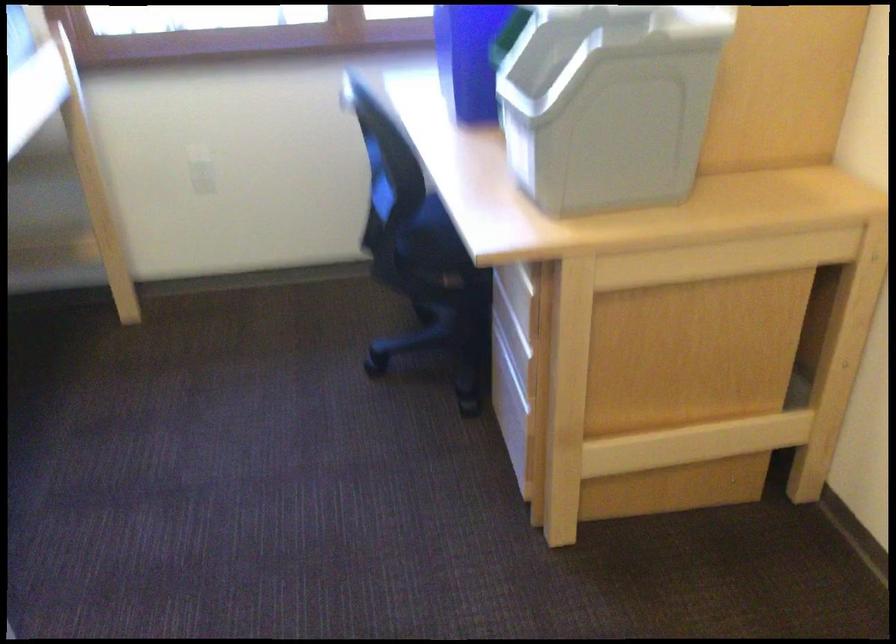
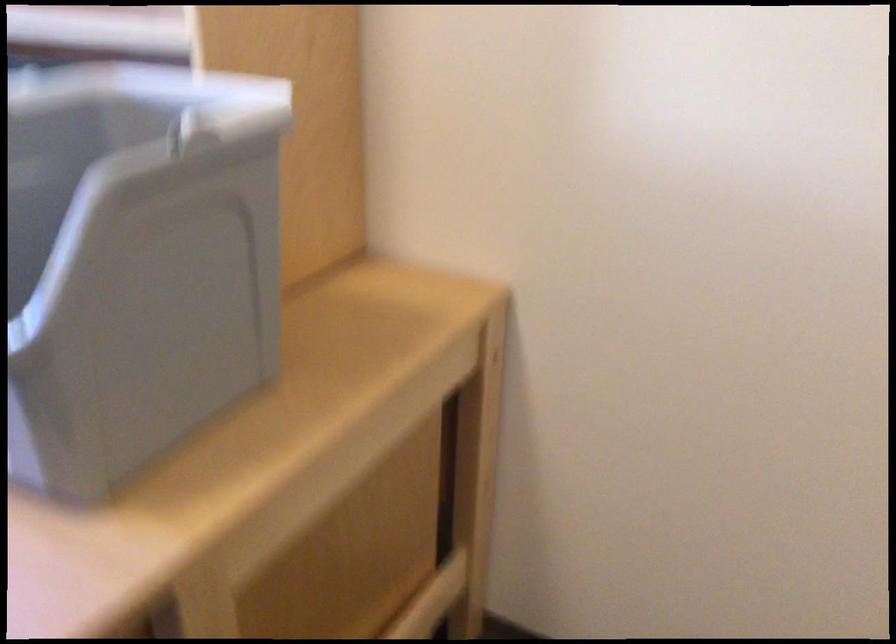
The point at (600, 97) is marked in the first image. Where is the corresponding point in the second image?

(135, 263)